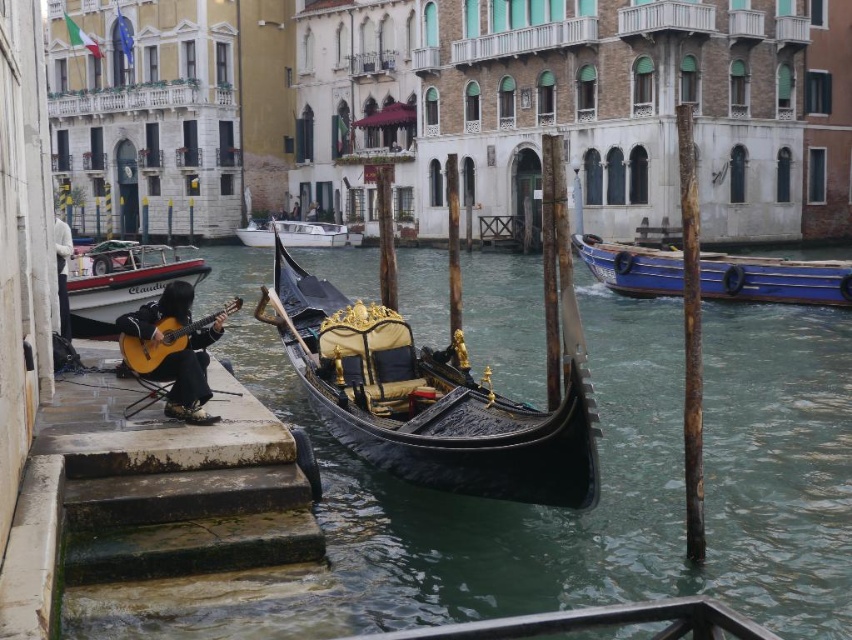
Between transparent water at gondola center and blue wooden boat at right, which one appears on the left side from the viewer's perspective?

From the viewer's perspective, transparent water at gondola center appears more on the left side.

Does transparent water at gondola center appear under blue wooden boat at right?

Yes.

Image resolution: width=852 pixels, height=640 pixels. I want to click on transparent water at gondola center, so click(600, 486).

Can you confirm if transparent water at gondola center is positioned above white plastic boat at left?

Actually, transparent water at gondola center is below white plastic boat at left.

Who is taller, transparent water at gondola center or white plastic boat at left?

transparent water at gondola center

Identify the location of transparent water at gondola center. Image resolution: width=852 pixels, height=640 pixels. (600, 486).

Does black polished wood gondola at center have a larger size compared to white glossy boat at center?

Yes, black polished wood gondola at center is bigger than white glossy boat at center.

Locate an element on the screen. The image size is (852, 640). black polished wood gondola at center is located at coordinates (429, 401).

Which is in front, point (496, 477) or point (324, 240)?

Point (496, 477) is in front.

The width and height of the screenshot is (852, 640). Find the location of `black polished wood gondola at center`. black polished wood gondola at center is located at coordinates (429, 401).